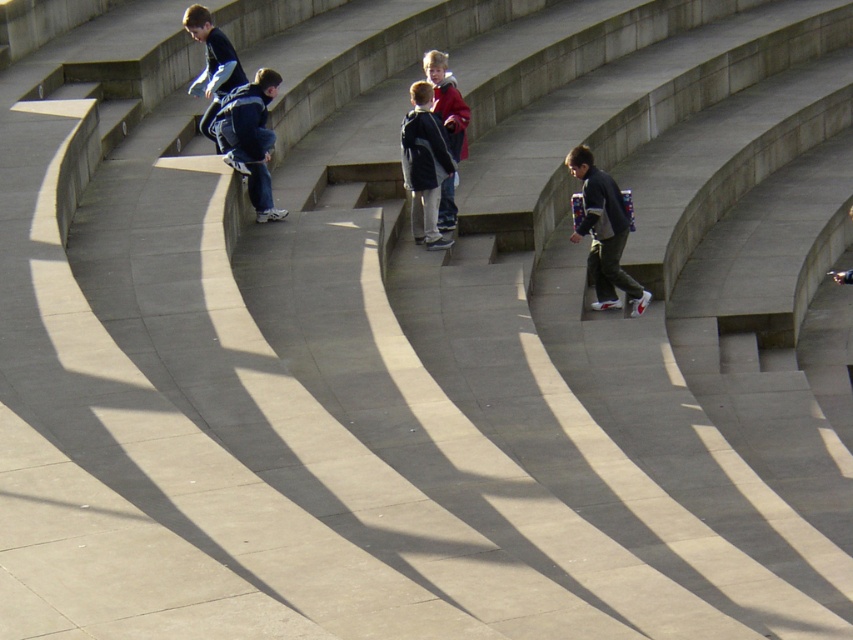
You are a photographer trying to capture the children playing on the curved concrete steps. You notice the point at coordinates (604, 234) on your camera screen. What object is located at that specific point?

The point at coordinates (604, 234) marks the dark gray fabric backpack at center.

You are a photographer trying to capture a candid shot of the two children wearing the dark blue jacket at center and the red matte jacket at center. You want to ensure that both subjects remain in frame without any part of them being cut off. Given that your camera has a 12.00 inch wide lens view, will you be able to fit both jackets into the frame?

The dark blue jacket at center is 15.00 inches from the red matte jacket at center. Since the distance between them exceeds the 12.00 inch width of the lens view, the photographer cannot fit both jackets into the frame without one being cut off.

You are a photographer standing at the edge of the curved concrete steps where the children are playing. You want to take a photo that includes the dark gray fabric backpack at center. Where should you position yourself to ensure the backpack is centered in your shot?

To center the dark gray fabric backpack at center in your photo, position yourself directly in line with its 2D coordinates at point (604, 234). This ensures the backpack will be at the center of your frame.